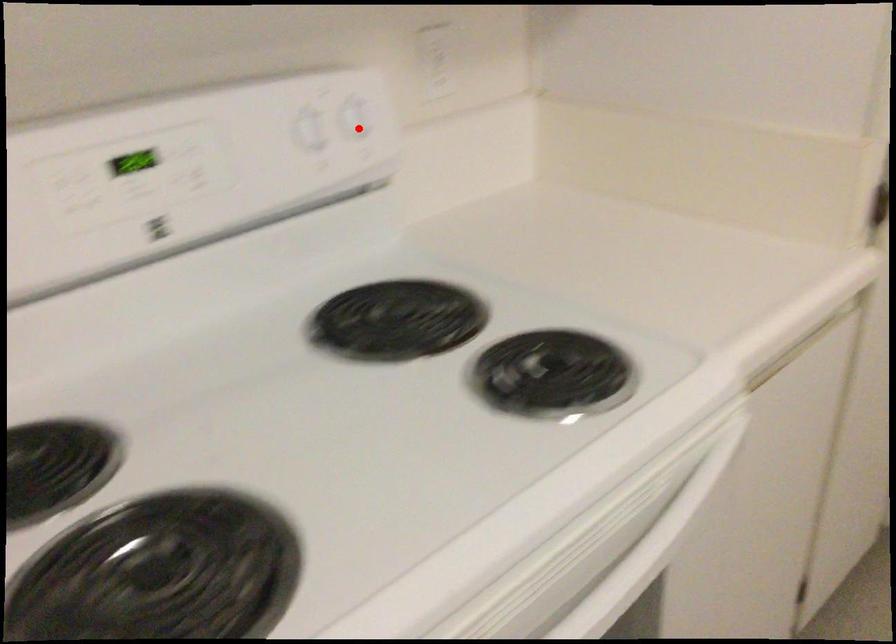
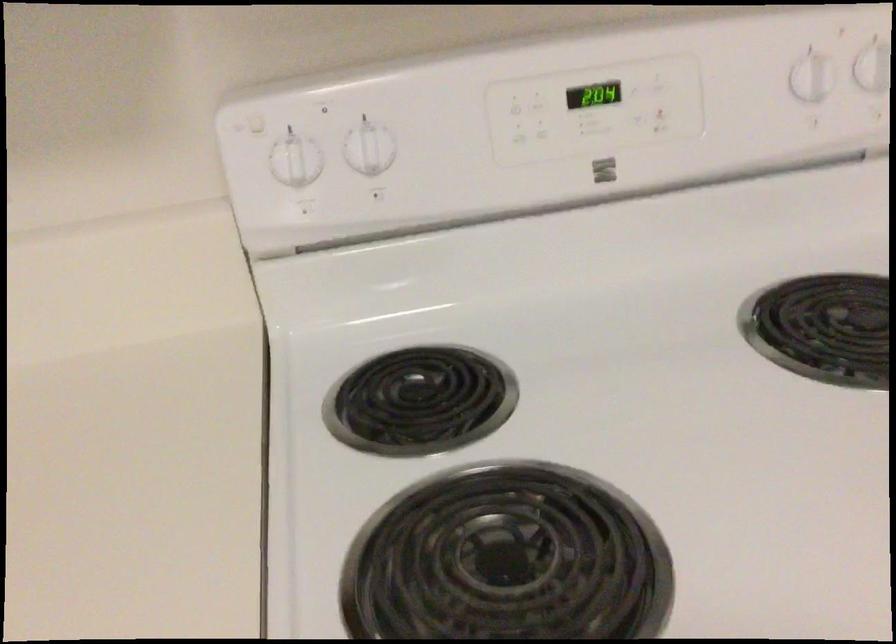
Find the pixel in the second image that matches the highlighted location in the first image.

(873, 68)